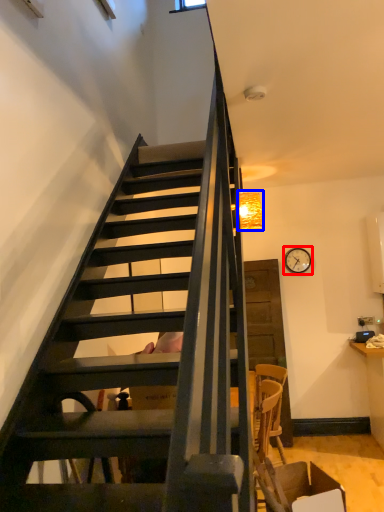
Question: Which point is closer to the camera, clock (highlighted by a red box) or lamp (highlighted by a blue box)?

Choices:
 (A) clock
 (B) lamp

Answer: (B)